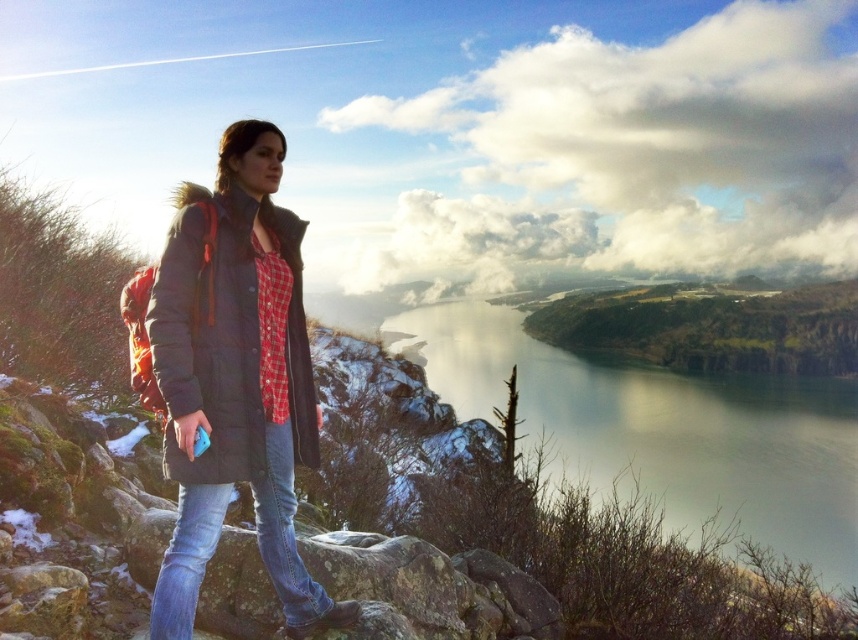
You are planning to take a photo of the green reflective water at center and the blue denim jeans at lower left. Which object should you focus on first if you want to capture both in one shot without moving the camera?

You should focus on the green reflective water at center first because its width is larger than the blue denim jeans at lower left, so it will require more attention to ensure it fits properly in the frame.

You are the person in the image, standing on the rocky outcrop. You want to place your matte black jacket at center onto the green reflective water at center. Is this possible based on their positions?

The green reflective water at center is located below the matte black jacket at center, so you can place the matte black jacket at center onto the green reflective water at center since it is positioned above it.

You are a hiker who wants to ensure your backpack fits through a narrow trail. You have two jackets, the matte black jacket at center and the dark gray puffer jacket at left. Which jacket is wider, and therefore might not fit through the narrow space?

The matte black jacket at center is wider than the dark gray puffer jacket at left, so it might not fit through the narrow space.